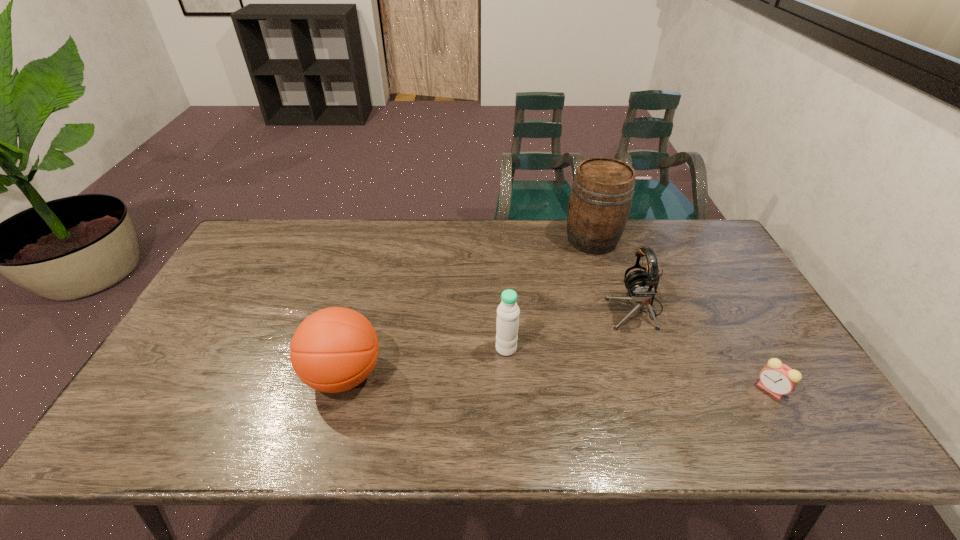
Find the location of `free space between the cider and the second farthest object`. free space between the cider and the second farthest object is located at coordinates (613, 274).

Identify the location of vacant point located between the earphone and the cider. This screenshot has width=960, height=540. (613, 274).

Where is `free point between the basketball and the fourth nearest object`? free point between the basketball and the fourth nearest object is located at coordinates (490, 342).

The width and height of the screenshot is (960, 540). In order to click on free space that is in between the shortest object and the leftmost object in this screenshot , I will do `click(557, 382)`.

Find the location of `free spot between the fourth object from right to left and the cider`. free spot between the fourth object from right to left and the cider is located at coordinates (549, 294).

Select which object appears as the third closest to the water bottle. Please provide its 2D coordinates. Your answer should be formatted as a tuple, i.e. [(x, y)], where the tuple contains the x and y coordinates of a point satisfying the conditions above.

[(601, 196)]

Locate which object is the second closest to the earphone. Please provide its 2D coordinates. Your answer should be formatted as a tuple, i.e. [(x, y)], where the tuple contains the x and y coordinates of a point satisfying the conditions above.

[(778, 379)]

This screenshot has height=540, width=960. Identify the location of vacant area that satisfies the following two spatial constraints: 1. on the back side of the water bottle; 2. on the right side of the basketball. (351, 348).

Where is `free location that satisfies the following two spatial constraints: 1. on the side of the fourth nearest object near the bung hole; 2. on the left side of the farthest object`? The height and width of the screenshot is (540, 960). free location that satisfies the following two spatial constraints: 1. on the side of the fourth nearest object near the bung hole; 2. on the left side of the farthest object is located at coordinates (613, 309).

The width and height of the screenshot is (960, 540). I want to click on vacant area in the image that satisfies the following two spatial constraints: 1. on the back side of the earphone; 2. on the side of the farthest object near the bung hole, so click(x=611, y=240).